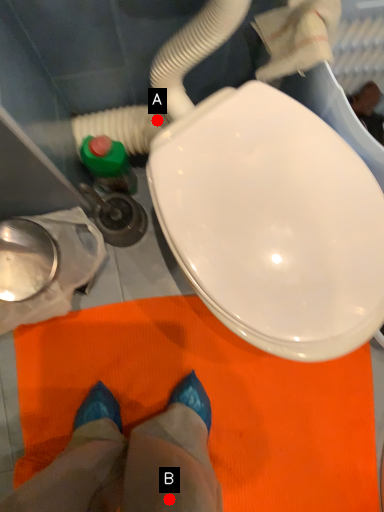
Question: Two points are circled on the image, labeled by A and B beside each circle. Which point is closer to the camera?

Choices:
 (A) A is closer
 (B) B is closer

Answer: (B)